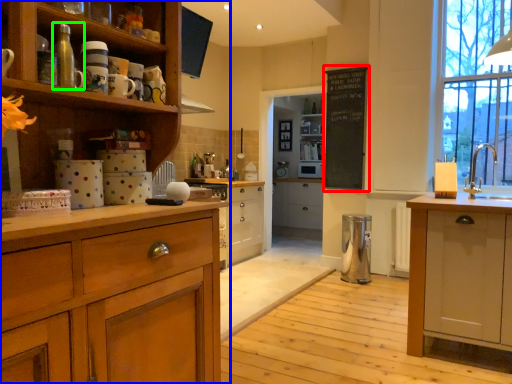
Question: Which object is the closest to the bulletin board (highlighted by a red box)? Choose among these: cupboard (highlighted by a blue box) or appliance (highlighted by a green box).

Choices:
 (A) cupboard
 (B) appliance

Answer: (A)